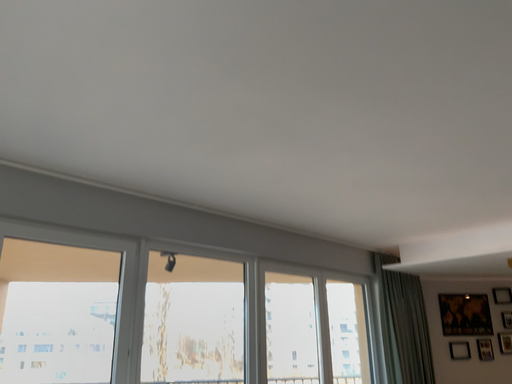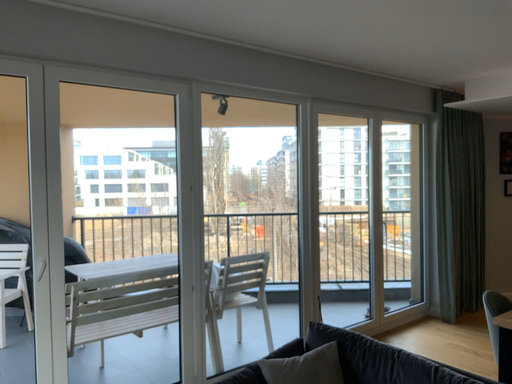
Question: How did the camera likely rotate when shooting the video?

Choices:
 (A) rotated downward
 (B) rotated upward

Answer: (A)